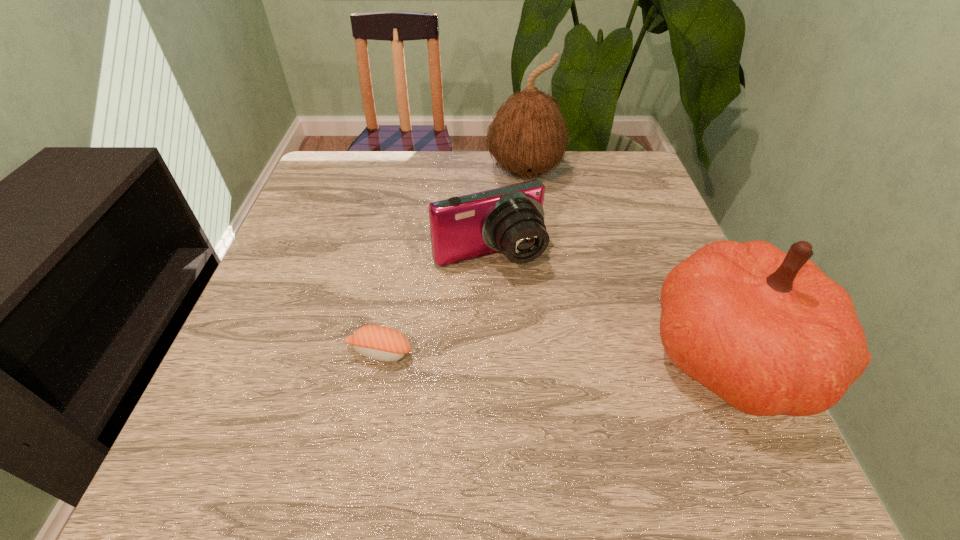
Locate an element on the screen. The width and height of the screenshot is (960, 540). blank space at the left edge is located at coordinates (316, 204).

Image resolution: width=960 pixels, height=540 pixels. In order to click on vacant space at the right edge of the desktop in this screenshot , I will do `click(612, 204)`.

In the image, there is a desktop. Identify the location of free space at the far left corner. (365, 178).

In the image, there is a desktop. Identify the location of vacant area at the far right corner. The width and height of the screenshot is (960, 540). (624, 166).

The image size is (960, 540). In the image, there is a desktop. Identify the location of vacant region at the near right corner. (710, 394).

The image size is (960, 540). I want to click on empty space between the rightmost object and the third tallest object, so click(x=610, y=305).

What are the coordinates of `free space that is in between the third shortest object and the camera` in the screenshot? It's located at (610, 305).

Where is `free space between the third shortest object and the coconut`? The width and height of the screenshot is (960, 540). free space between the third shortest object and the coconut is located at coordinates (628, 264).

Identify the location of free point between the third tallest object and the pumpkin. (610, 305).

Locate an element on the screen. The height and width of the screenshot is (540, 960). vacant region between the second shortest object and the pumpkin is located at coordinates (610, 305).